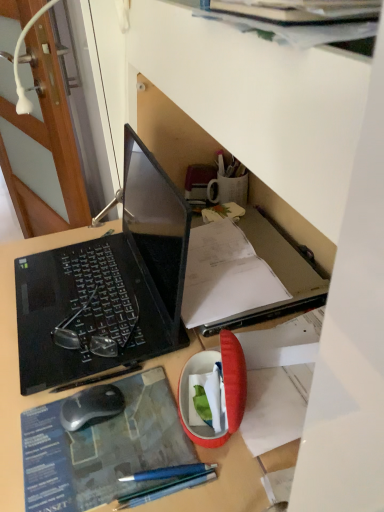
Question: From the image's perspective, is black matte laptop at left located above or below wooden door at left?

Choices:
 (A) below
 (B) above

Answer: (A)

Question: Visually, is black matte laptop at left positioned to the left or to the right of wooden door at left?

Choices:
 (A) right
 (B) left

Answer: (A)

Question: Based on their relative distances, which object is farther from the wooden door at left?

Choices:
 (A) blue paper at center
 (B) black matte laptop at left
 (C) silver matte computer mouse at lower left

Answer: (C)

Question: Which object is the closest to the silver matte computer mouse at lower left?

Choices:
 (A) wooden door at left
 (B) blue paper at center
 (C) black matte laptop at left

Answer: (B)